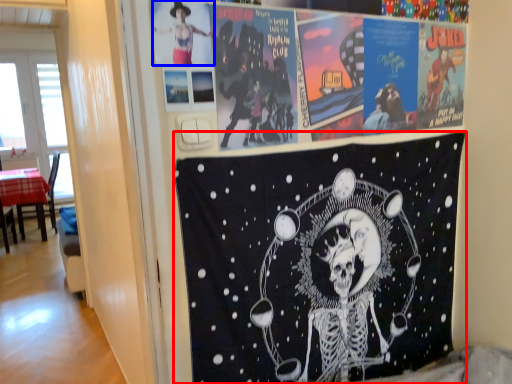
Question: Which point is further to the camera, poster (highlighted by a red box) or person (highlighted by a blue box)?

Choices:
 (A) poster
 (B) person

Answer: (A)